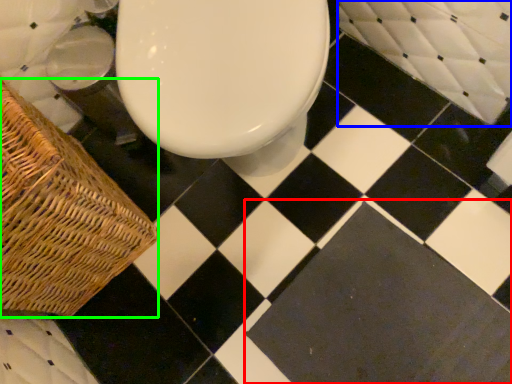
Question: Considering the real-world distances, which object is farthest from square (highlighted by a red box)? bath (highlighted by a blue box) or picnic basket (highlighted by a green box)?

Choices:
 (A) bath
 (B) picnic basket

Answer: (B)